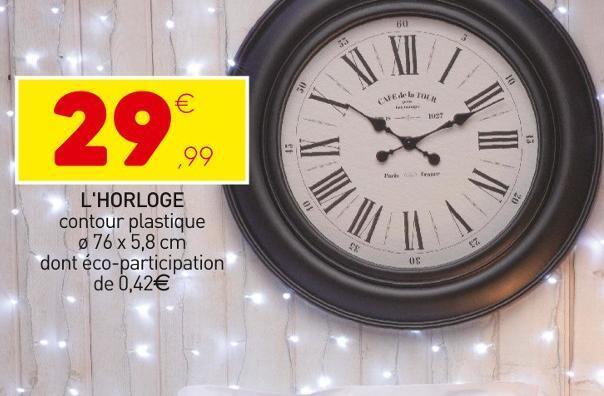
This screenshot has height=396, width=604. In order to click on minute clock hand in this screenshot , I will do `click(458, 117)`.